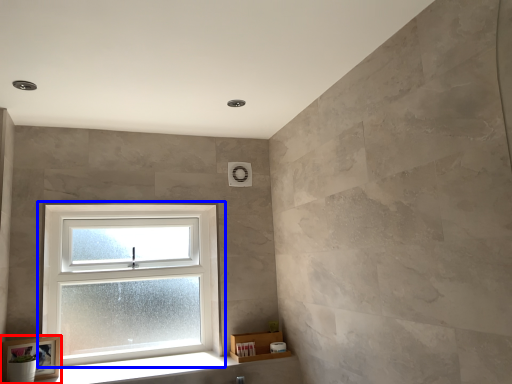
Question: Which object appears farthest to the camera in this image, picture frame (highlighted by a red box) or window (highlighted by a blue box)?

Choices:
 (A) picture frame
 (B) window

Answer: (B)